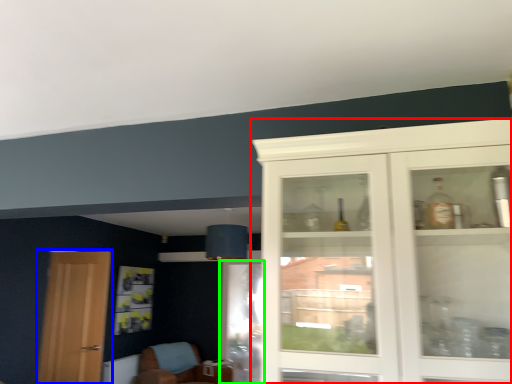
Question: Which object is the closest to the cabinetry (highlighted by a red box)? Choose among these: door (highlighted by a blue box) or screen door (highlighted by a green box).

Choices:
 (A) door
 (B) screen door

Answer: (B)